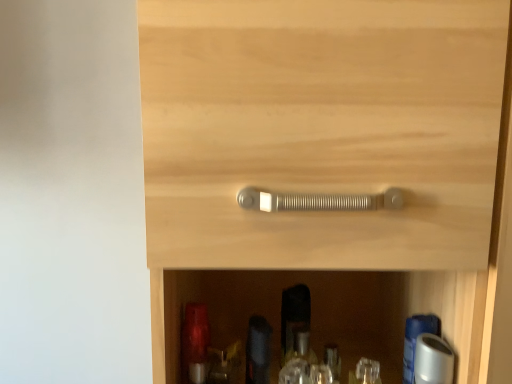
Question: Is matte red glass bottle at lower left, the first bottle from the left, located within clear plastic bottle at lower center, the second bottle in the right-to-left sequence?

Choices:
 (A) yes
 (B) no

Answer: (B)

Question: Is clear plastic bottle at lower center, the second bottle in the right-to-left sequence, to the left of matte red glass bottle at lower left, which is the 4th bottle from right to left, from the viewer's perspective?

Choices:
 (A) no
 (B) yes

Answer: (A)

Question: Does clear plastic bottle at lower center, the third bottle from the left, appear on the right side of matte red glass bottle at lower left, which is the 4th bottle from right to left?

Choices:
 (A) no
 (B) yes

Answer: (B)

Question: Is clear plastic bottle at lower center, the third bottle from the left, facing away from matte red glass bottle at lower left, which is the 4th bottle from right to left?

Choices:
 (A) yes
 (B) no

Answer: (B)

Question: Does clear plastic bottle at lower center, the second bottle in the right-to-left sequence, have a larger size compared to matte red glass bottle at lower left, the first bottle from the left?

Choices:
 (A) no
 (B) yes

Answer: (A)

Question: Considering the positions of point pyautogui.click(x=445, y=198) and point pyautogui.click(x=252, y=372), is point pyautogui.click(x=445, y=198) closer or farther from the camera than point pyautogui.click(x=252, y=372)?

Choices:
 (A) closer
 (B) farther

Answer: (A)

Question: Is matte silver handle at center taller or shorter than matte black bottle at lower center, placed as the third bottle when sorted from right to left?

Choices:
 (A) tall
 (B) short

Answer: (A)

Question: From a real-world perspective, is matte silver handle at center positioned above or below matte black bottle at lower center, placed as the third bottle when sorted from right to left?

Choices:
 (A) below
 (B) above

Answer: (B)

Question: In the image, is matte silver handle at center on the left side or the right side of matte black bottle at lower center, placed as the third bottle when sorted from right to left?

Choices:
 (A) left
 (B) right

Answer: (B)

Question: Does point (301, 375) appear closer or farther from the camera than point (267, 322)?

Choices:
 (A) farther
 (B) closer

Answer: (B)

Question: From a real-world perspective, relative to matte black bottle at lower center, which is the 2th bottle in left-to-right order, is clear plastic bottle at lower center, the third bottle from the left, vertically above or below?

Choices:
 (A) below
 (B) above

Answer: (A)

Question: Looking at the image, does clear plastic bottle at lower center, the third bottle from the left, seem bigger or smaller compared to matte black bottle at lower center, which is the 2th bottle in left-to-right order?

Choices:
 (A) big
 (B) small

Answer: (B)

Question: Relative to matte black bottle at lower center, placed as the third bottle when sorted from right to left, is clear plastic bottle at lower center, the third bottle from the left, in front or behind?

Choices:
 (A) front
 (B) behind

Answer: (B)

Question: From a real-world perspective, is white glossy bottle at lower right, arranged as the 4th bottle when viewed from the left, above or below clear plastic bottle at lower center, the second bottle in the right-to-left sequence?

Choices:
 (A) below
 (B) above

Answer: (B)

Question: Considering the positions of white glossy bottle at lower right, placed as the first bottle when sorted from right to left, and clear plastic bottle at lower center, the third bottle from the left, in the image, is white glossy bottle at lower right, placed as the first bottle when sorted from right to left, taller or shorter than clear plastic bottle at lower center, the third bottle from the left,?

Choices:
 (A) tall
 (B) short

Answer: (A)